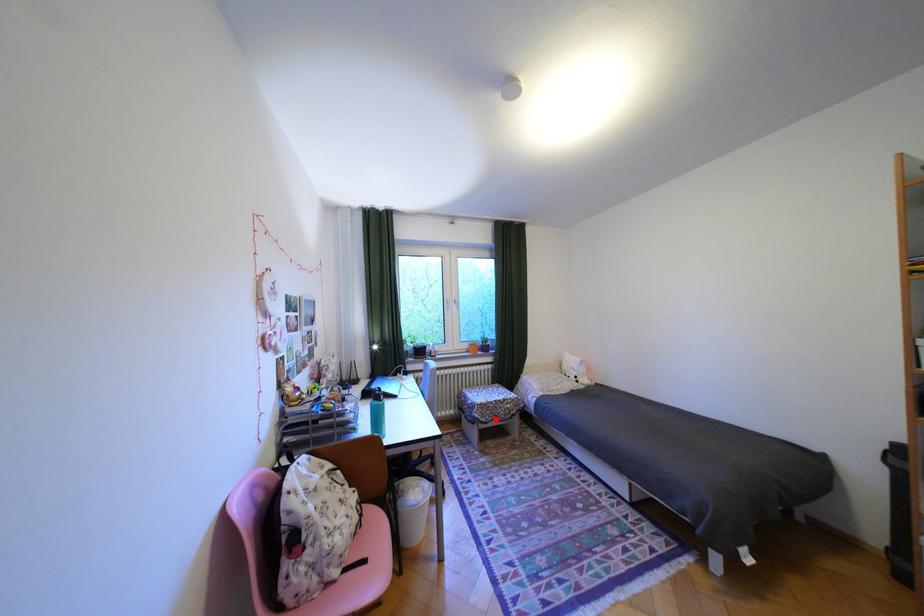
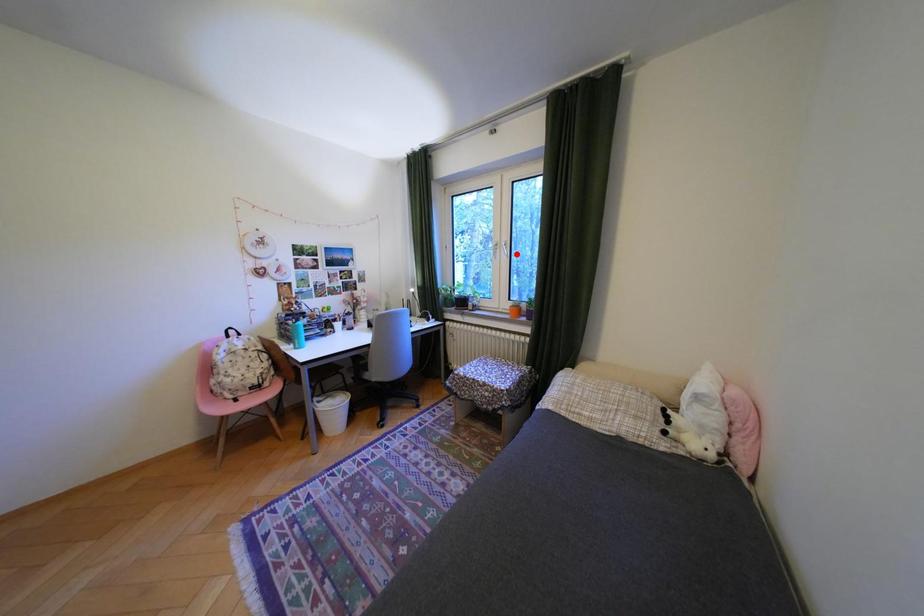
I am providing you with two images of the same scene from different viewpoints. A red point is marked on the first image and another point is marked on the second image. Does the point marked in image1 correspond to the same location as the one in image2?

No